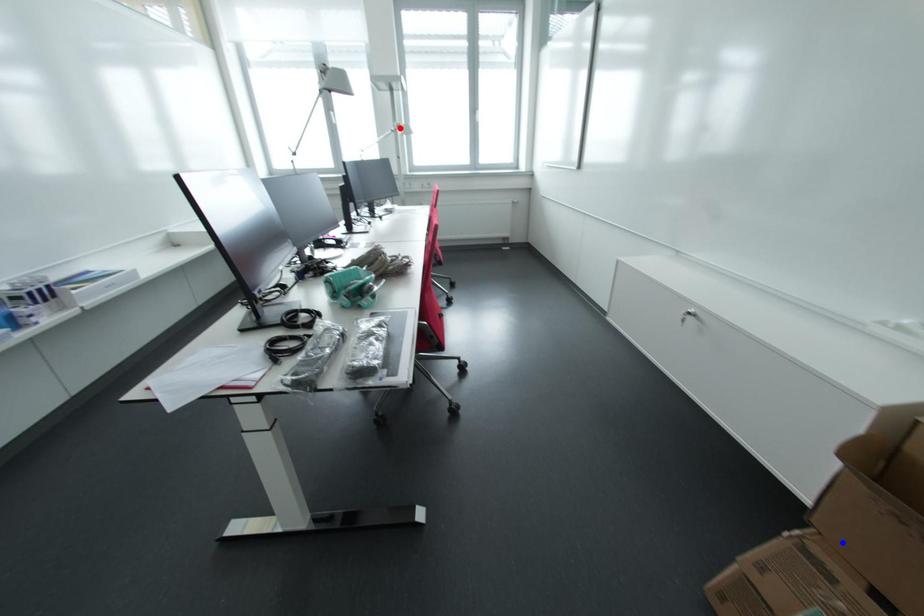
Question: Two points are marked on the image. Which point is closer to the camera?

Choices:
 (A) Blue point is closer.
 (B) Red point is closer.

Answer: (A)